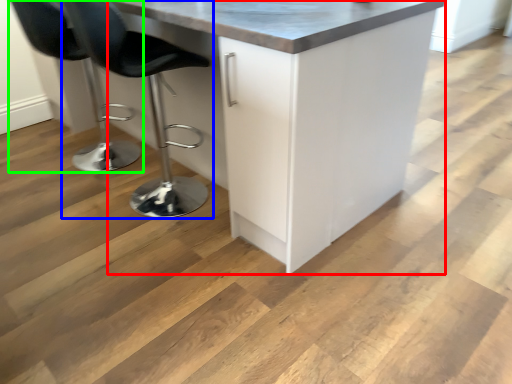
Question: Based on their relative distances, which object is farther from cabinetry (highlighted by a red box)? Choose from chair (highlighted by a blue box) and chair (highlighted by a green box).

Choices:
 (A) chair
 (B) chair

Answer: (B)